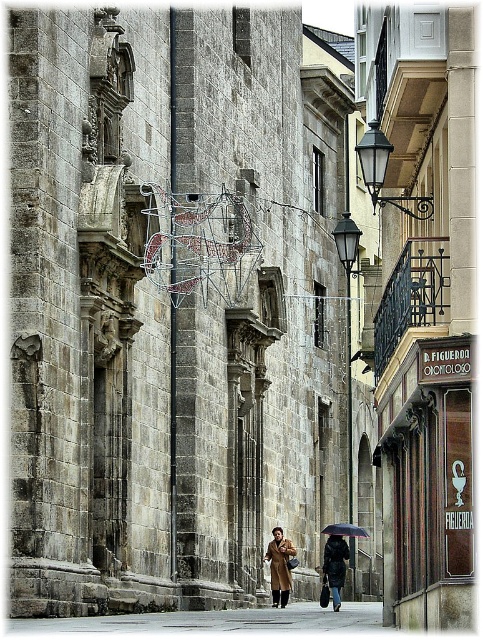
You are a delivery person carrying a large package and need to place it on the ground near the dark brown leather coat at center. Where exactly should you place it?

The dark brown leather coat at center is located at point (335, 566), so you should place the package near those coordinates.